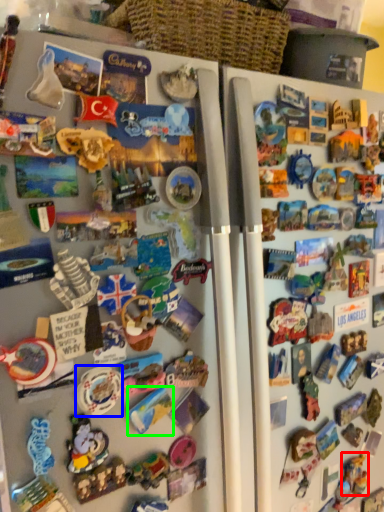
Question: Which object is positioned farthest from toy (highlighted by a red box)? Select from toy (highlighted by a blue box) and toy (highlighted by a green box).

Choices:
 (A) toy
 (B) toy

Answer: (A)